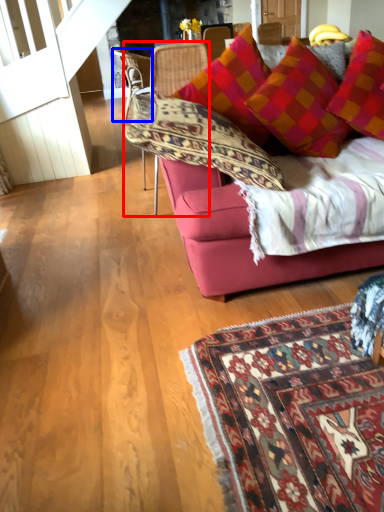
Question: Which of the following is the farthest to the observer, chair (highlighted by a red box) or chair (highlighted by a blue box)?

Choices:
 (A) chair
 (B) chair

Answer: (B)